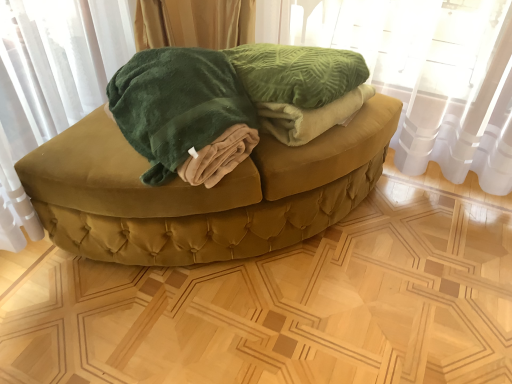
What do you see at coordinates (202, 193) in the screenshot?
I see `velvet green ottoman at center` at bounding box center [202, 193].

This screenshot has width=512, height=384. In order to click on green velvet curtain at upper center in this screenshot , I will do `click(433, 76)`.

Where is `velvety green blanket at center`? velvety green blanket at center is located at coordinates (184, 114).

Which is more to the left, velvety green blanket at center or green velvet curtain at upper center?

velvety green blanket at center is more to the left.

Is velvety green blanket at center directly adjacent to green velvet curtain at upper center?

No, velvety green blanket at center is not beside green velvet curtain at upper center.

Does velvety green blanket at center have a smaller size compared to green velvet curtain at upper center?

Yes.

Is velvety green blanket at center taller or shorter than green velvet curtain at upper center?

In the image, velvety green blanket at center appears to be shorter than green velvet curtain at upper center.

Is velvet green ottoman at center oriented away from green velvet curtain at upper center?

That's not correct — velvet green ottoman at center is not looking away from green velvet curtain at upper center.

From the image's perspective, is velvet green ottoman at center on top of green velvet curtain at upper center?

Incorrect, from the image's perspective, velvet green ottoman at center is lower than green velvet curtain at upper center.

Is velvet green ottoman at center spatially inside green velvet curtain at upper center, or outside of it?

velvet green ottoman at center exists outside the volume of green velvet curtain at upper center.

Identify the location of curtain above the velvet green ottoman at center (from a real-world perspective). The width and height of the screenshot is (512, 384). (433, 76).

Would you say green velvet curtain at upper center is outside velvet green ottoman at center?

green velvet curtain at upper center is positioned outside velvet green ottoman at center.

From a real-world perspective, is green velvet curtain at upper center below velvet green ottoman at center?

Incorrect, from a real-world perspective, green velvet curtain at upper center is higher than velvet green ottoman at center.

Which object is wider, green velvet curtain at upper center or velvet green ottoman at center?

With larger width is velvet green ottoman at center.

Identify the location of curtain above the velvet green ottoman at center (from a real-world perspective). (433, 76).

Find the location of a particular element. furniture below the velvety green blanket at center (from a real-world perspective) is located at coordinates coord(202,193).

Looking at their sizes, would you say velvet green ottoman at center is wider or thinner than velvety green blanket at center?

Considering their sizes, velvet green ottoman at center looks broader than velvety green blanket at center.

Is velvety green blanket at center surrounded by velvet green ottoman at center?

No, velvety green blanket at center is not a part of velvet green ottoman at center.

Identify the location of cloth in front of the green velvet curtain at upper center. The image size is (512, 384). (184, 114).

Is green velvet curtain at upper center facing towards velvety green blanket at center?

No, green velvet curtain at upper center is not facing towards velvety green blanket at center.

Is green velvet curtain at upper center located outside velvety green blanket at center?

Yes.

From a real-world perspective, is green velvet curtain at upper center physically above velvety green blanket at center?

No, from a real-world perspective, green velvet curtain at upper center is not on top of velvety green blanket at center.

Is point (131, 122) in front of point (152, 239)?

Yes, it is in front of point (152, 239).

From the picture: From the image's perspective, is velvety green blanket at center located above or below velvet green ottoman at center?

Based on their image positions, velvety green blanket at center is located above velvet green ottoman at center.

Which of these two, velvety green blanket at center or velvet green ottoman at center, is thinner?

velvety green blanket at center.

Based on the photo, is velvet green ottoman at center at the back of velvety green blanket at center?

No, velvety green blanket at center's orientation is not away from velvet green ottoman at center.

This screenshot has width=512, height=384. I want to click on cloth that appears in front of the green velvet curtain at upper center, so click(x=184, y=114).

This screenshot has height=384, width=512. Find the location of `curtain located above the velvet green ottoman at center (from the image's perspective)`. curtain located above the velvet green ottoman at center (from the image's perspective) is located at coordinates (433, 76).

Estimate the real-world distances between objects in this image. Which object is closer to velvet green ottoman at center, velvety green blanket at center or green velvet curtain at upper center?

velvety green blanket at center lies closer to velvet green ottoman at center than the other object.

Considering their positions, is velvet green ottoman at center positioned further to green velvet curtain at upper center than velvety green blanket at center?

velvety green blanket at center is further to green velvet curtain at upper center.

Based on their spatial positions, is velvety green blanket at center or velvet green ottoman at center closer to green velvet curtain at upper center?

velvet green ottoman at center lies closer to green velvet curtain at upper center than the other object.

Looking at the image, which one is located closer to velvety green blanket at center, green velvet curtain at upper center or velvet green ottoman at center?

velvet green ottoman at center is positioned closer to the anchor velvety green blanket at center.

Which object lies further to the anchor point velvety green blanket at center, velvet green ottoman at center or green velvet curtain at upper center?

green velvet curtain at upper center is positioned further to the anchor velvety green blanket at center.

Looking at the image, which one is located closer to velvet green ottoman at center, green velvet curtain at upper center or velvety green blanket at center?

velvety green blanket at center is closer to velvet green ottoman at center.

This screenshot has width=512, height=384. Find the location of `furniture located between velvety green blanket at center and green velvet curtain at upper center in the left-right direction`. furniture located between velvety green blanket at center and green velvet curtain at upper center in the left-right direction is located at coordinates (202, 193).